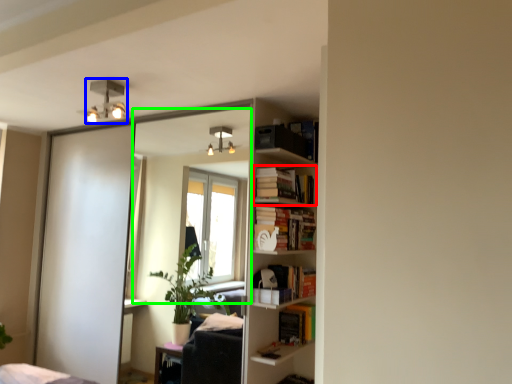
Question: Considering the real-world distances, which object is closest to book (highlighted by a red box)? light fixture (highlighted by a blue box) or mirror (highlighted by a green box).

Choices:
 (A) light fixture
 (B) mirror

Answer: (A)